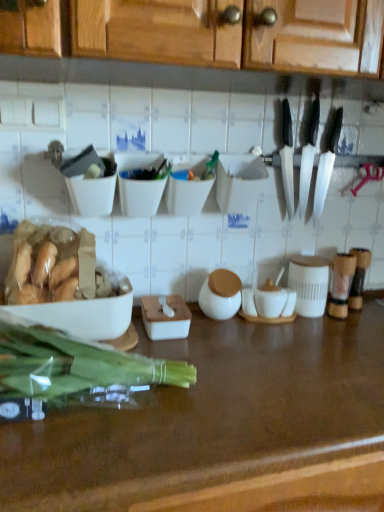
Image resolution: width=384 pixels, height=512 pixels. Identify the location of white plastic container at center, acting as the third bowl starting from the left. (186, 193).

Measure the distance between brown polished wood countertop at center and camera.

The distance of brown polished wood countertop at center from camera is 20.93 inches.

Locate an element on the screen. The width and height of the screenshot is (384, 512). translucent plastic green vegetables at left is located at coordinates (75, 365).

The width and height of the screenshot is (384, 512). What do you see at coordinates (75, 365) in the screenshot?
I see `translucent plastic green vegetables at left` at bounding box center [75, 365].

Describe the element at coordinates (83, 315) in the screenshot. I see `white matte bowl at left` at that location.

What do you see at coordinates (92, 194) in the screenshot?
I see `white matte bowl at upper left, the third bowl from the right` at bounding box center [92, 194].

The height and width of the screenshot is (512, 384). What do you see at coordinates (326, 166) in the screenshot?
I see `black plastic knives at upper right` at bounding box center [326, 166].

The width and height of the screenshot is (384, 512). What do you see at coordinates (140, 193) in the screenshot?
I see `white matte bowl at upper center, which is counted as the second bowl, starting from the left` at bounding box center [140, 193].

In order to face silver metallic knife at upper right, positioned as the second kitchen knife in left-to-right order, should I rotate leftwards or rightwards?

To align with it, rotate right about 17.440°.

You are a GUI agent. You are given a task and a screenshot of the screen. Output one action in this format:
    pyautogui.click(x=<x>, y=<y>)
    Task: Click on the silver metallic knife at upper right, positioned as the second kitchen knife in left-to-right order
    The image size is (384, 512).
    Given the screenshot: What is the action you would take?
    pyautogui.click(x=326, y=167)

The width and height of the screenshot is (384, 512). What are the coordinates of `white plastic container at center, acting as the third bowl starting from the left` in the screenshot? It's located at (186, 193).

Is point (310, 170) closer or farther from the camera than point (318, 196)?

Point (310, 170) is closer to the camera than point (318, 196).

Is black plastic knife at upper right, the first kitchen knife positioned from the left, next to silver metallic knife at upper right, positioned as the second kitchen knife in left-to-right order?

Yes, the surface of black plastic knife at upper right, the first kitchen knife positioned from the left, is in contact with silver metallic knife at upper right, positioned as the second kitchen knife in left-to-right order.

Who is more distant, black plastic knife at upper right, placed as the second kitchen knife when sorted from right to left, or silver metallic knife at upper right, positioned as the second kitchen knife in left-to-right order?

black plastic knife at upper right, placed as the second kitchen knife when sorted from right to left, is further from the camera.

Considering the sizes of objects black plastic knife at upper right, placed as the second kitchen knife when sorted from right to left, and silver metallic knife at upper right, arranged as the first kitchen knife when viewed from the right, in the image provided, who is taller, black plastic knife at upper right, placed as the second kitchen knife when sorted from right to left, or silver metallic knife at upper right, arranged as the first kitchen knife when viewed from the right,?

With more height is silver metallic knife at upper right, arranged as the first kitchen knife when viewed from the right.

Is white matte bowl at upper center, which is counted as the second bowl, starting from the left, inside the boundaries of brown polished wood countertop at center, or outside?

white matte bowl at upper center, which is counted as the second bowl, starting from the left, exists outside the volume of brown polished wood countertop at center.

Is white matte bowl at upper center, which is counted as the second bowl, starting from the left, looking in the opposite direction of brown polished wood countertop at center?

No, brown polished wood countertop at center is not at the back of white matte bowl at upper center, which is counted as the second bowl, starting from the left.

In terms of width, does white matte bowl at upper center, the second bowl when ordered from right to left, look wider or thinner when compared to brown polished wood countertop at center?

white matte bowl at upper center, the second bowl when ordered from right to left, is thinner than brown polished wood countertop at center.

Is white matte bowl at upper center, which is counted as the second bowl, starting from the left, further to camera compared to brown polished wood countertop at center?

That is True.

Can you tell me how much white matte bowl at left and white matte bowl at upper center, the second bowl when ordered from right to left, differ in facing direction?

The angular difference between white matte bowl at left and white matte bowl at upper center, the second bowl when ordered from right to left, is 2.76 degrees.

Is white matte bowl at left positioned in front of white matte bowl at upper center, which is counted as the second bowl, starting from the left?

Yes, white matte bowl at left is in front of white matte bowl at upper center, which is counted as the second bowl, starting from the left.

Starting from the white matte bowl at left, which bowl is the 2nd one to the right? Please provide its 2D coordinates.

[(140, 193)]

In terms of width, does white matte bowl at upper left, the 1th bowl viewed from the left, look wider or thinner when compared to white matte bowl at left?

In the image, white matte bowl at upper left, the 1th bowl viewed from the left, appears to be more narrow than white matte bowl at left.

Which of these two, white matte bowl at upper left, the 1th bowl viewed from the left, or white matte bowl at left, stands shorter?

white matte bowl at left is shorter.

Find the location of a particular element. This screenshot has height=512, width=384. bowl that is the 1st object located above the white matte bowl at left (from the image's perspective) is located at coordinates (92, 194).

Can you tell me how much black plastic knives at upper right and white plastic container at center, acting as the third bowl starting from the left, differ in facing direction?

There is a 2.64-degree angle between the facing directions of black plastic knives at upper right and white plastic container at center, acting as the third bowl starting from the left.

How far apart are black plastic knives at upper right and white plastic container at center, the 1th bowl from the right?

33.41 centimeters.

In the scene shown: Is black plastic knives at upper right touching white plastic container at center, the 1th bowl from the right?

No, black plastic knives at upper right is not next to white plastic container at center, the 1th bowl from the right.

Which is more to the right, black plastic knives at upper right or white plastic container at center, acting as the third bowl starting from the left?

black plastic knives at upper right.

Would you say silver metallic knife at upper right, positioned as the second kitchen knife in left-to-right order, is outside black plastic knife at upper right, the first kitchen knife positioned from the left?

That's correct, silver metallic knife at upper right, positioned as the second kitchen knife in left-to-right order, is outside of black plastic knife at upper right, the first kitchen knife positioned from the left.

Is the position of silver metallic knife at upper right, positioned as the second kitchen knife in left-to-right order, more distant than that of black plastic knife at upper right, the first kitchen knife positioned from the left?

No, it is in front of black plastic knife at upper right, the first kitchen knife positioned from the left.

Is silver metallic knife at upper right, positioned as the second kitchen knife in left-to-right order, directly adjacent to black plastic knife at upper right, placed as the second kitchen knife when sorted from right to left?

Yes, silver metallic knife at upper right, positioned as the second kitchen knife in left-to-right order, is with black plastic knife at upper right, placed as the second kitchen knife when sorted from right to left.

From the image's perspective, is brown polished wood countertop at center located above black plastic knife at upper right, placed as the second kitchen knife when sorted from right to left?

No, from the image's perspective, brown polished wood countertop at center is not on top of black plastic knife at upper right, placed as the second kitchen knife when sorted from right to left.

Would you say brown polished wood countertop at center is inside or outside black plastic knife at upper right, placed as the second kitchen knife when sorted from right to left?

brown polished wood countertop at center is spatially situated outside black plastic knife at upper right, placed as the second kitchen knife when sorted from right to left.

Is brown polished wood countertop at center taller or shorter than black plastic knife at upper right, placed as the second kitchen knife when sorted from right to left?

In the image, brown polished wood countertop at center appears to be taller than black plastic knife at upper right, placed as the second kitchen knife when sorted from right to left.

From a real-world perspective, does brown polished wood countertop at center sit lower than black plastic knife at upper right, the first kitchen knife positioned from the left?

Yes, from a real-world perspective, brown polished wood countertop at center is below black plastic knife at upper right, the first kitchen knife positioned from the left.

The height and width of the screenshot is (512, 384). Identify the location of kitchen knife in front of the black plastic knife at upper right, the first kitchen knife positioned from the left. (326, 167).

Image resolution: width=384 pixels, height=512 pixels. In order to click on bowl that is the 2nd one when counting leftward from the brown polished wood countertop at center in this screenshot , I will do `click(140, 193)`.

Estimate the real-world distances between objects in this image. Which object is closer to white matte bowl at upper center, which is counted as the second bowl, starting from the left, black plastic knife at upper right, the first kitchen knife positioned from the left, or white plastic container at center, acting as the third bowl starting from the left?

white plastic container at center, acting as the third bowl starting from the left, is positioned closer to the anchor white matte bowl at upper center, which is counted as the second bowl, starting from the left.

Estimate the real-world distances between objects in this image. Which object is closer to white plastic container at center, acting as the third bowl starting from the left, white matte bowl at left or black plastic knives at upper right?

Among the two, white matte bowl at left is located nearer to white plastic container at center, acting as the third bowl starting from the left.

Looking at the image, which one is located further to white matte bowl at upper left, the 1th bowl viewed from the left, black plastic knives at upper right or black plastic knife at upper right, the first kitchen knife positioned from the left?

The object further to white matte bowl at upper left, the 1th bowl viewed from the left, is black plastic knife at upper right, the first kitchen knife positioned from the left.

Estimate the real-world distances between objects in this image. Which object is further from white matte bowl at upper left, the 1th bowl viewed from the left, black plastic knives at upper right or white matte bowl at left?

black plastic knives at upper right is further to white matte bowl at upper left, the 1th bowl viewed from the left.

Estimate the real-world distances between objects in this image. Which object is closer to translucent plastic green vegetables at left, white matte bowl at upper left, the 1th bowl viewed from the left, or white plastic container at center, acting as the third bowl starting from the left?

Based on the image, white matte bowl at upper left, the 1th bowl viewed from the left, appears to be nearer to translucent plastic green vegetables at left.

Estimate the real-world distances between objects in this image. Which object is closer to silver metallic knife at upper right, arranged as the first kitchen knife when viewed from the right, white plastic container at center, the 1th bowl from the right, or brown polished wood countertop at center?

Based on the image, white plastic container at center, the 1th bowl from the right, appears to be nearer to silver metallic knife at upper right, arranged as the first kitchen knife when viewed from the right.

Estimate the real-world distances between objects in this image. Which object is further from brown polished wood countertop at center, black plastic knife at upper right, placed as the second kitchen knife when sorted from right to left, or white matte bowl at left?

black plastic knife at upper right, placed as the second kitchen knife when sorted from right to left, lies further to brown polished wood countertop at center than the other object.

Considering their positions, is white matte bowl at upper left, the 1th bowl viewed from the left, positioned further to white matte bowl at left than black plastic knives at upper right?

black plastic knives at upper right.

This screenshot has height=512, width=384. In order to click on tableware that lies between white plastic container at center, the 1th bowl from the right, and translucent plastic green vegetables at left from top to bottom in this screenshot , I will do `click(83, 315)`.

This screenshot has width=384, height=512. Find the location of `tableware between black plastic knives at upper right and brown polished wood countertop at center in the up-down direction`. tableware between black plastic knives at upper right and brown polished wood countertop at center in the up-down direction is located at coordinates (83, 315).

Where is `green vegetables between white plastic container at center, acting as the third bowl starting from the left, and brown polished wood countertop at center, in the vertical direction`? Image resolution: width=384 pixels, height=512 pixels. green vegetables between white plastic container at center, acting as the third bowl starting from the left, and brown polished wood countertop at center, in the vertical direction is located at coordinates (75, 365).

Image resolution: width=384 pixels, height=512 pixels. Find the location of `green vegetables situated between white matte bowl at left and black plastic knife at upper right, placed as the second kitchen knife when sorted from right to left, from left to right`. green vegetables situated between white matte bowl at left and black plastic knife at upper right, placed as the second kitchen knife when sorted from right to left, from left to right is located at coordinates (75, 365).